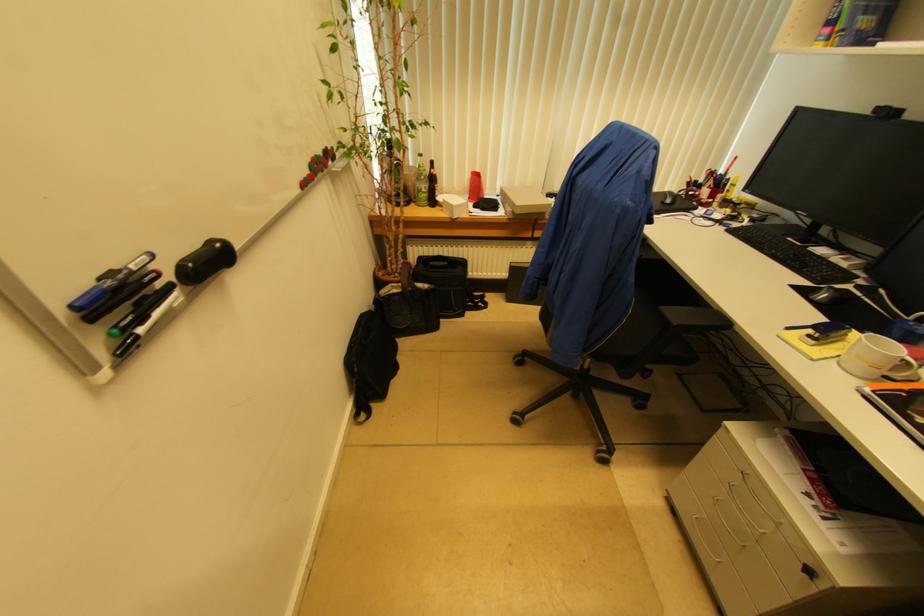
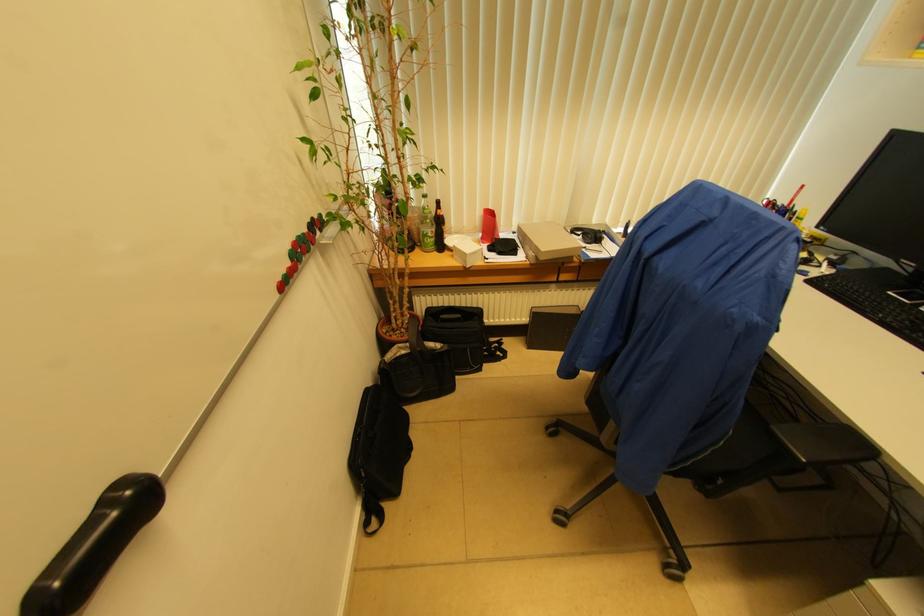
Where in the second image is the point corresponding to (x=181, y=270) from the first image?

(35, 600)